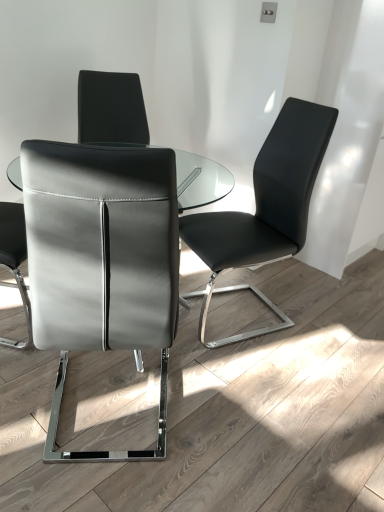
At what (x,y) coordinates should I click in order to perform the action: click on free spot below matte black chair at left, positioned as the 2th chair in right-to-left order (from a real-world perspective). Please return your answer as a coordinate pair (x, y). The width and height of the screenshot is (384, 512). Looking at the image, I should click on (104, 416).